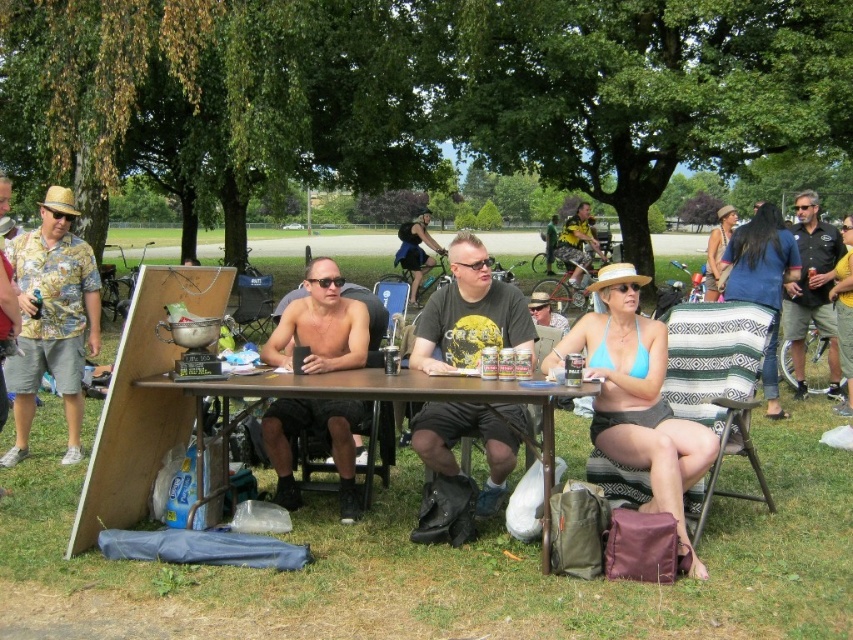
Who is taller, shiny black shorts at center or black leather jacket at upper right?

black leather jacket at upper right

Is point (271, 362) less distant than point (821, 257)?

That is True.

Is point (270, 349) positioned before point (837, 385)?

Yes, point (270, 349) is in front of point (837, 385).

Locate an element on the screen. shiny black shorts at center is located at coordinates (320, 324).

Does yellow printed t-shirt at center have a lesser width compared to black leather jacket at upper right?

Yes, yellow printed t-shirt at center is thinner than black leather jacket at upper right.

Is yellow printed t-shirt at center bigger than black leather jacket at upper right?

No.

Which is in front, point (508, 428) or point (821, 225)?

Point (508, 428) is more forward.

The width and height of the screenshot is (853, 640). What are the coordinates of `yellow printed t-shirt at center` in the screenshot? It's located at (469, 314).

You are a GUI agent. You are given a task and a screenshot of the screen. Output one action in this format:
    pyautogui.click(x=<x>, y=<y>)
    Task: Click on the floral shirt at left
    Image resolution: width=853 pixels, height=640 pixels.
    Given the screenshot: What is the action you would take?
    point(51,320)

Between floral shirt at left and shiny black shorts at center, which one is positioned higher?

floral shirt at left

The image size is (853, 640). In order to click on floral shirt at left in this screenshot , I will do `click(51, 320)`.